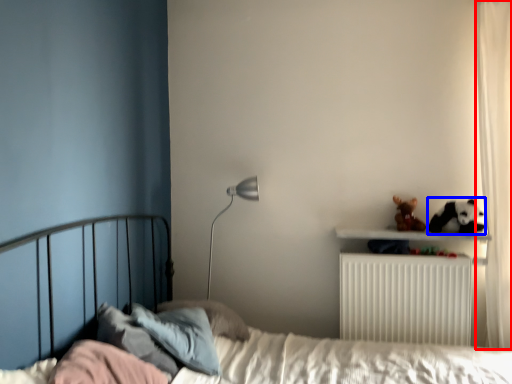
Question: Which of the following is the farthest to the observer, curtain (highlighted by a red box) or animal (highlighted by a blue box)?

Choices:
 (A) curtain
 (B) animal

Answer: (B)